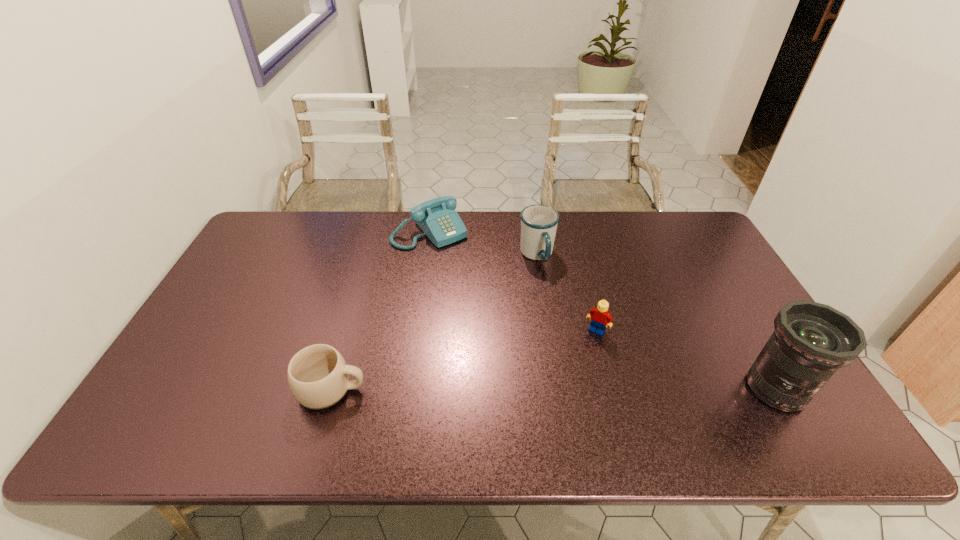
Where is `vacant space in between the taller mug and the Lego`? The height and width of the screenshot is (540, 960). vacant space in between the taller mug and the Lego is located at coordinates (566, 293).

Choose which object is the second nearest neighbor to the rightmost object. Please provide its 2D coordinates. Your answer should be formatted as a tuple, i.e. [(x, y)], where the tuple contains the x and y coordinates of a point satisfying the conditions above.

[(539, 223)]

Image resolution: width=960 pixels, height=540 pixels. Find the location of `object that is the fourth closest one to the nearer mug`. object that is the fourth closest one to the nearer mug is located at coordinates (811, 341).

Locate an element on the screen. This screenshot has height=540, width=960. free location that satisfies the following two spatial constraints: 1. on the front side of the telephone; 2. on the left side of the fourth shortest object is located at coordinates (426, 255).

At what (x,y) coordinates should I click in order to perform the action: click on free space that satisfies the following two spatial constraints: 1. on the front side of the fourth object from left to right; 2. on the left side of the telephone. Please return your answer as a coordinate pair (x, y). This screenshot has height=540, width=960. Looking at the image, I should click on (416, 330).